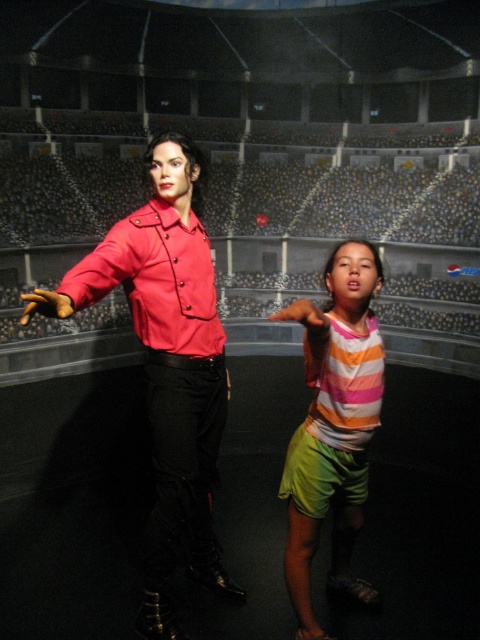
Question: Which point is farther to the camera?

Choices:
 (A) striped cotton shirt at center
 (B) matte red jacket at left

Answer: (A)

Question: Is matte red jacket at left above striped cotton shirt at center?

Choices:
 (A) no
 (B) yes

Answer: (B)

Question: Is matte red jacket at left to the right of striped cotton shirt at center from the viewer's perspective?

Choices:
 (A) yes
 (B) no

Answer: (B)

Question: Can you confirm if matte red jacket at left is bigger than striped cotton shirt at center?

Choices:
 (A) no
 (B) yes

Answer: (B)